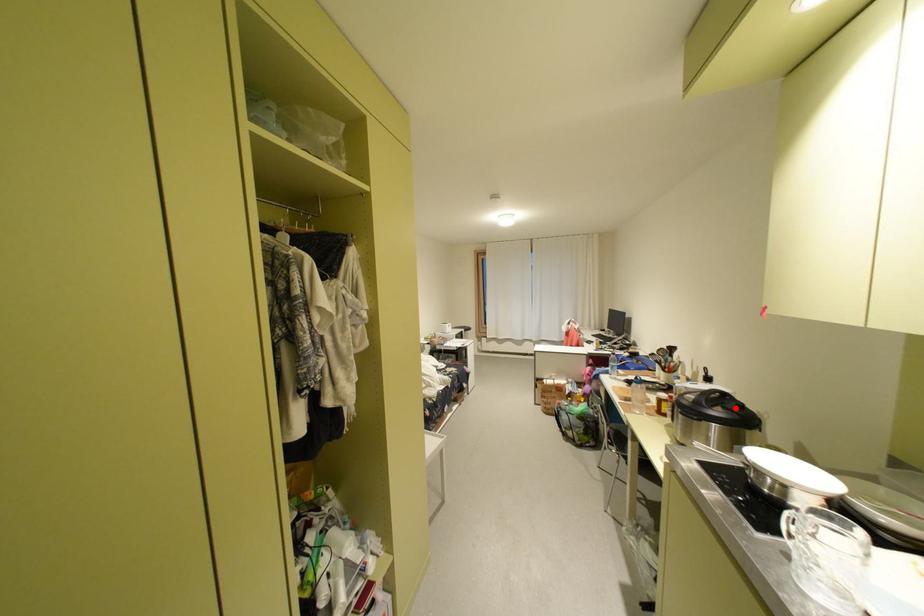
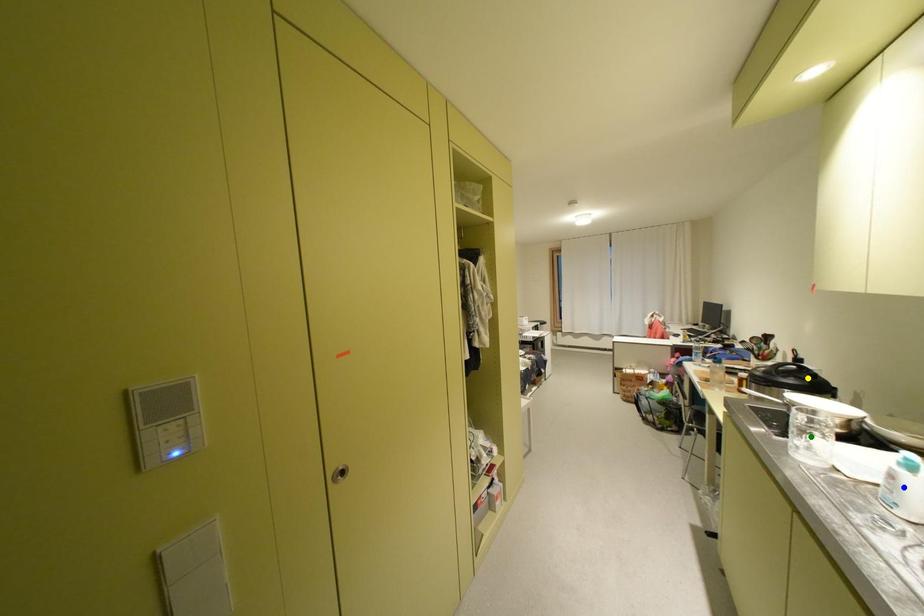
Question: I am providing you with two images of the same scene from different viewpoints. A red point is marked on the first image. You are given multiple points on the second image. Which mark in image 2 goes with the point in image 1?

Choices:
 (A) yellow point
 (B) blue point
 (C) green point

Answer: (A)